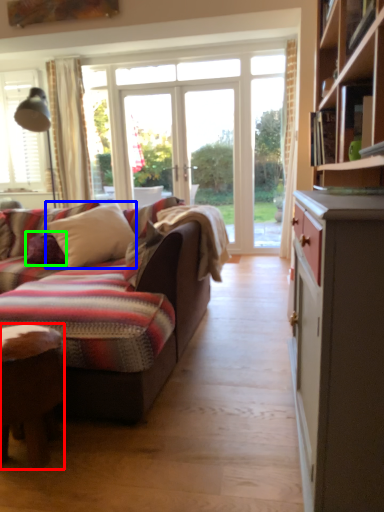
Question: Which is farther away from desk (highlighted by a red box)? pillow (highlighted by a blue box) or pillow (highlighted by a green box)?

Choices:
 (A) pillow
 (B) pillow

Answer: (B)